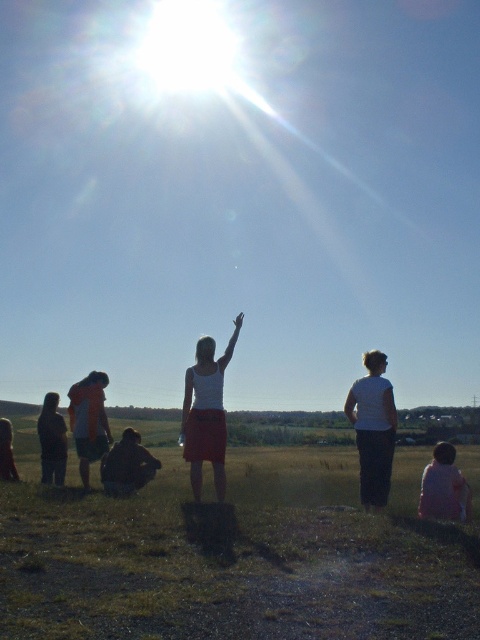
Question: Which point is closer to the camera taking this photo?

Choices:
 (A) (124, 452)
 (B) (243, 570)
 (C) (206, 435)

Answer: (B)

Question: Is white fabric skirt at center to the left of orange fabric shirt at left from the viewer's perspective?

Choices:
 (A) yes
 (B) no

Answer: (B)

Question: Which object is farther from the camera taking this photo?

Choices:
 (A) pink fabric at lower right
 (B) orange fabric shirt at left
 (C) white fabric skirt at center

Answer: (B)

Question: Is the position of white fabric skirt at center more distant than that of dark brown fabric at lower left?

Choices:
 (A) no
 (B) yes

Answer: (A)

Question: Which object is closer to the camera taking this photo?

Choices:
 (A) white matte shirt at center
 (B) dark brown fabric at lower left
 (C) orange fabric shirt at left
 (D) white fabric skirt at center

Answer: (D)

Question: Does orange fabric shirt at left appear under dark brown fabric at lower left?

Choices:
 (A) yes
 (B) no

Answer: (B)